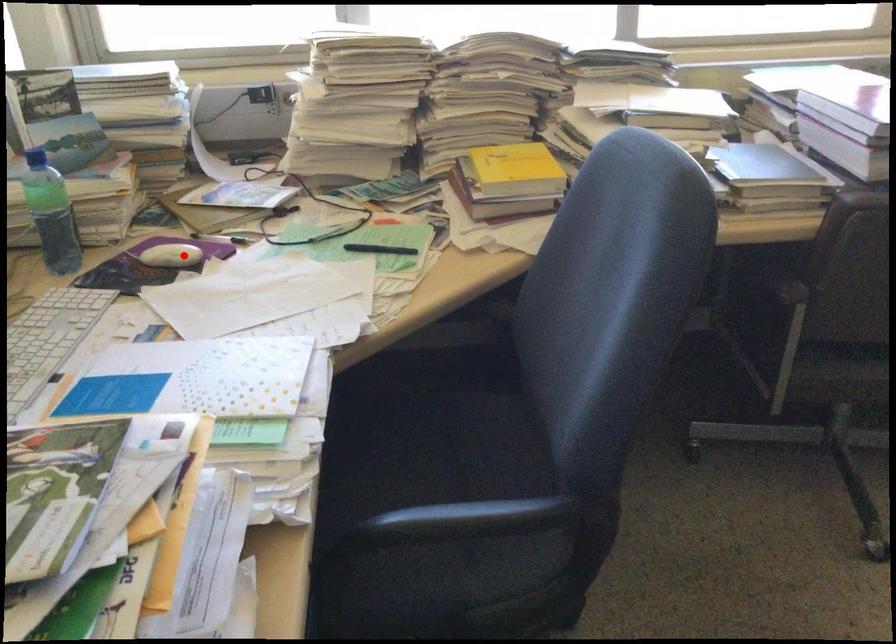
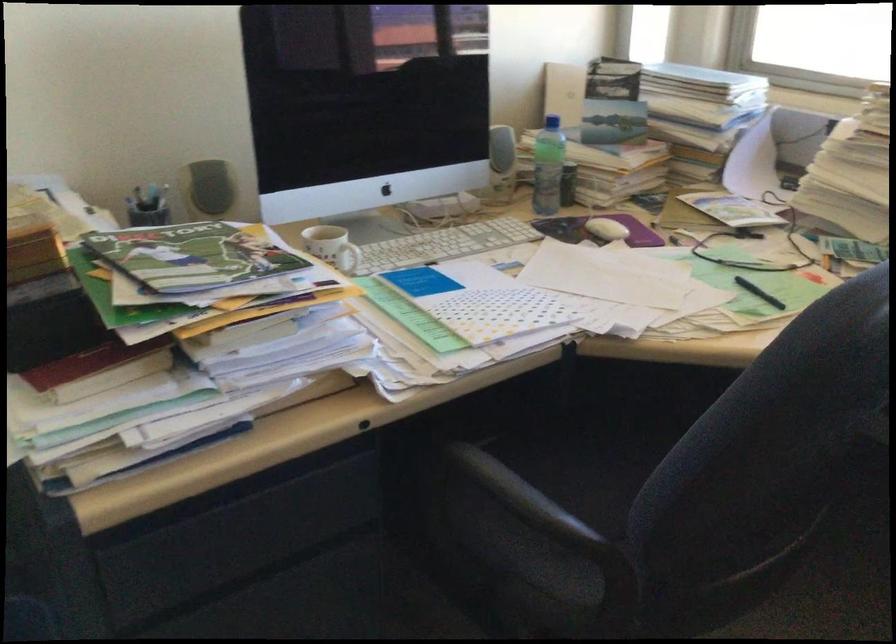
Question: I am providing you with two images of the same scene from different viewpoints. Given a red point in image1, look at the same physical point in image2. Is it:

Choices:
 (A) Closer to the viewpoint
 (B) Farther from the viewpoint

Answer: (B)